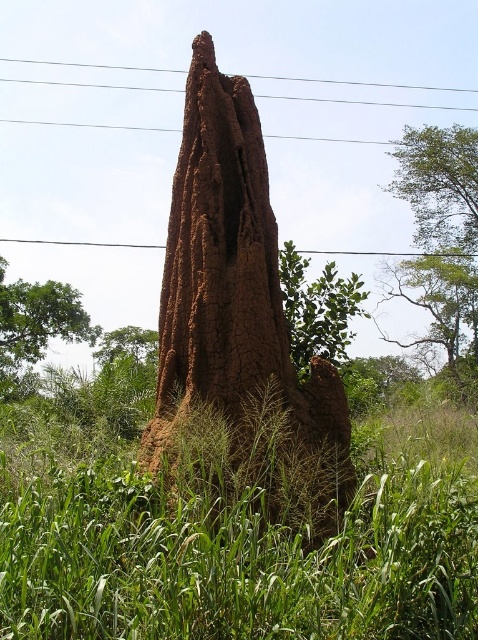
Question: Does brown clay termite mound at center have a greater width compared to green leafy tree at upper right?

Choices:
 (A) yes
 (B) no

Answer: (B)

Question: Does green leafy tree at left have a lesser width compared to green leafy tree at center?

Choices:
 (A) no
 (B) yes

Answer: (A)

Question: Does green leafy tree at upper right have a smaller size compared to green leafy tree at center?

Choices:
 (A) yes
 (B) no

Answer: (B)

Question: Which of these objects is positioned farthest from the green leafy tree at left?

Choices:
 (A) green leafy tree at upper right
 (B) green leafy tree at center

Answer: (A)

Question: Among these points, which one is farthest from the camera?

Choices:
 (A) (88, 339)
 (B) (336, 417)
 (C) (356, 285)
 (D) (422, 276)

Answer: (D)

Question: Which is farther from the green leafy tree at left?

Choices:
 (A) brown clay termite mound at center
 (B) green leafy tree at upper right

Answer: (B)